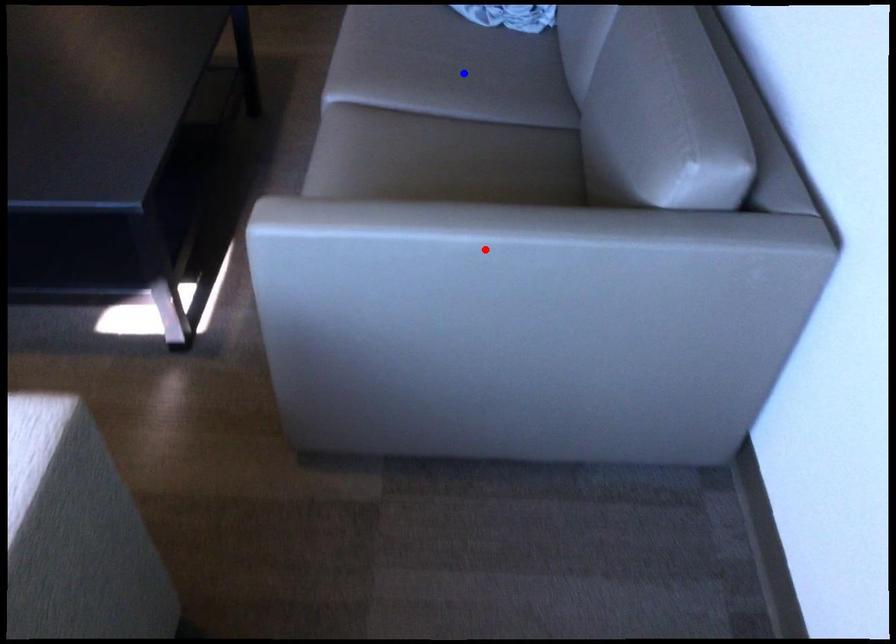
Question: Two points are marked on the image. Which point is closer to the camera?

Choices:
 (A) Blue point is closer.
 (B) Red point is closer.

Answer: (B)